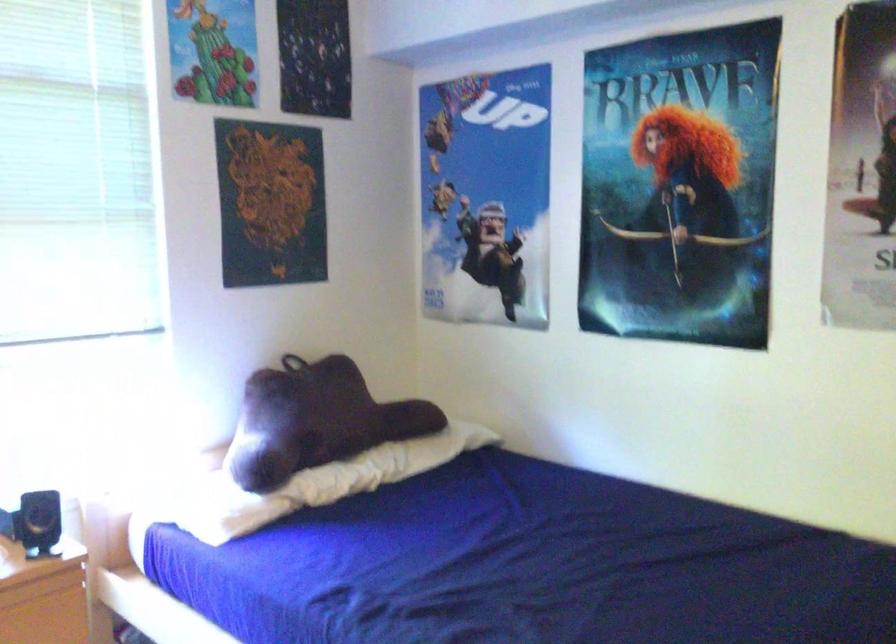
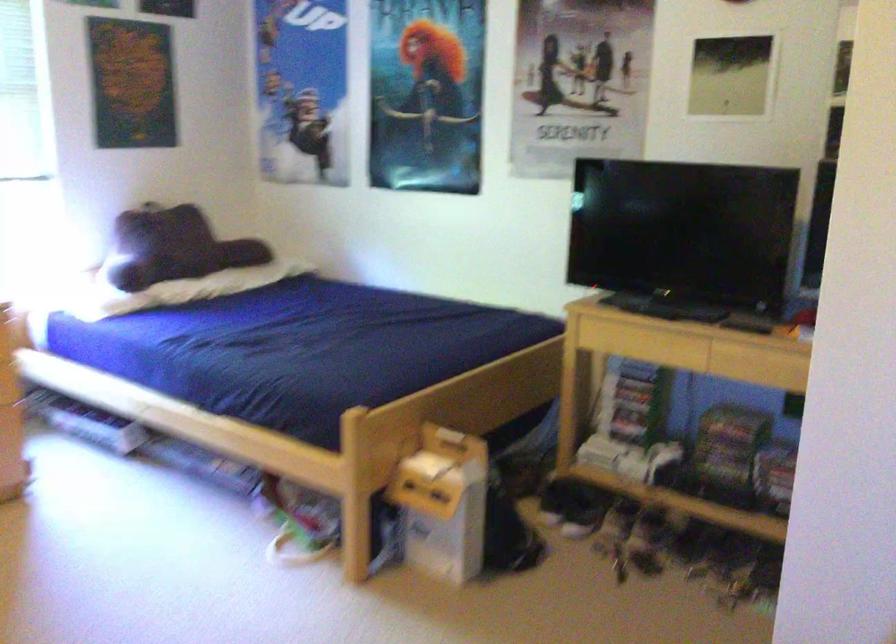
Question: Which direction would the cameraman need to move to produce the second image? Reply with the corresponding letter.

Choices:
 (A) Left
 (B) Right
 (C) Forward
 (D) Backward

Answer: (D)